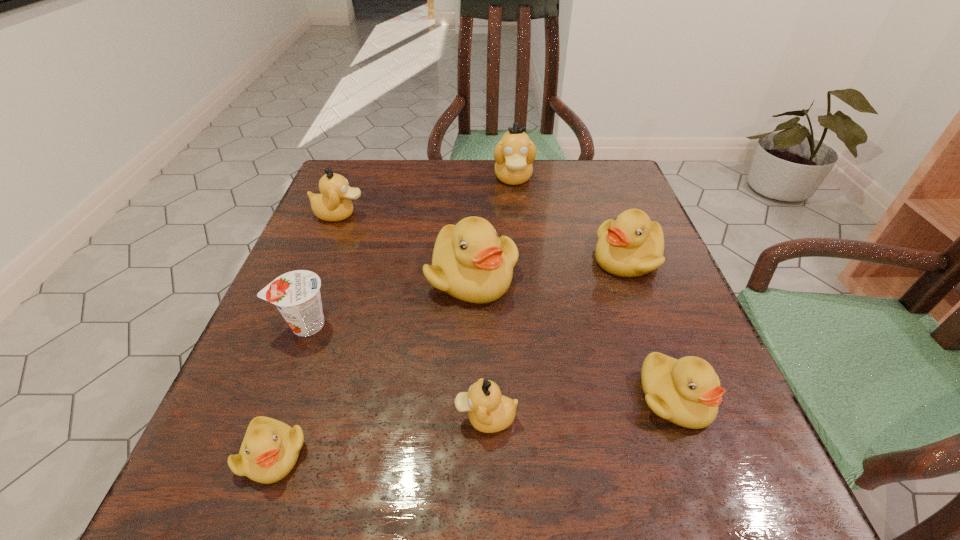
At what (x,y) coordinates should I click in order to perform the action: click on vacant area located 0.250m on the face of the smallest tan duckling. Please return your answer as a coordinate pair (x, y). Looking at the image, I should click on (285, 418).

I want to click on free spot located on the face of the smallest tan duckling, so click(265, 418).

You are a GUI agent. You are given a task and a screenshot of the screen. Output one action in this format:
    pyautogui.click(x=<x>, y=<y>)
    Task: Click on the object located in the near edge section of the desktop
    The height and width of the screenshot is (540, 960).
    Given the screenshot: What is the action you would take?
    pyautogui.click(x=270, y=449)

You are a GUI agent. You are given a task and a screenshot of the screen. Output one action in this format:
    pyautogui.click(x=<x>, y=<y>)
    Task: Click on the yogurt that is at the left edge
    The width and height of the screenshot is (960, 540).
    Given the screenshot: What is the action you would take?
    pyautogui.click(x=296, y=294)

Where is `object located in the far left corner section of the desktop`? The height and width of the screenshot is (540, 960). object located in the far left corner section of the desktop is located at coordinates (333, 204).

Locate an element on the screen. The image size is (960, 540). object located at the near left corner is located at coordinates (270, 449).

Image resolution: width=960 pixels, height=540 pixels. What are the coordinates of `free space at the far edge of the desktop` in the screenshot? It's located at (473, 172).

Where is `free region at the near edge of the desktop`? This screenshot has height=540, width=960. free region at the near edge of the desktop is located at coordinates coord(527,523).

The width and height of the screenshot is (960, 540). In order to click on free space at the left edge of the desktop in this screenshot , I will do pos(324,282).

In the image, there is a desktop. At what (x,y) coordinates should I click in order to perform the action: click on free space at the right edge. Please return your answer as a coordinate pair (x, y). This screenshot has height=540, width=960. Looking at the image, I should click on (621, 379).